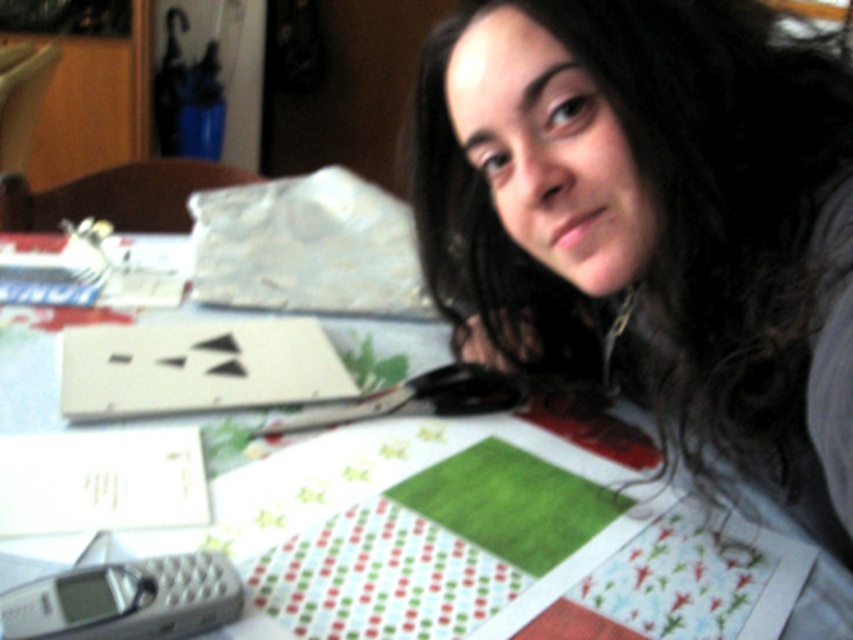
Is point (73, 580) positioned after point (618, 442)?

No, it is not.

Between gray quilted phone at lower left and green felt at center, which one has more height?

green felt at center is taller.

Is point (0, 627) closer to camera compared to point (822, 592)?

Yes, it is.

The width and height of the screenshot is (853, 640). I want to click on gray quilted phone at lower left, so click(x=126, y=600).

Is matte black hair at upper center to the right of gray quilted phone at lower left from the viewer's perspective?

Indeed, matte black hair at upper center is positioned on the right side of gray quilted phone at lower left.

Is point (728, 3) farther from camera compared to point (42, 608)?

Yes, point (728, 3) is behind point (42, 608).

Locate an element on the screen. The width and height of the screenshot is (853, 640). matte black hair at upper center is located at coordinates (654, 221).

Image resolution: width=853 pixels, height=640 pixels. Describe the element at coordinates (654, 221) in the screenshot. I see `matte black hair at upper center` at that location.

Between matte black hair at upper center and green felt at center, which one has less height?

green felt at center

This screenshot has width=853, height=640. What do you see at coordinates (654, 221) in the screenshot?
I see `matte black hair at upper center` at bounding box center [654, 221].

Where is `matte black hair at upper center`? matte black hair at upper center is located at coordinates (654, 221).